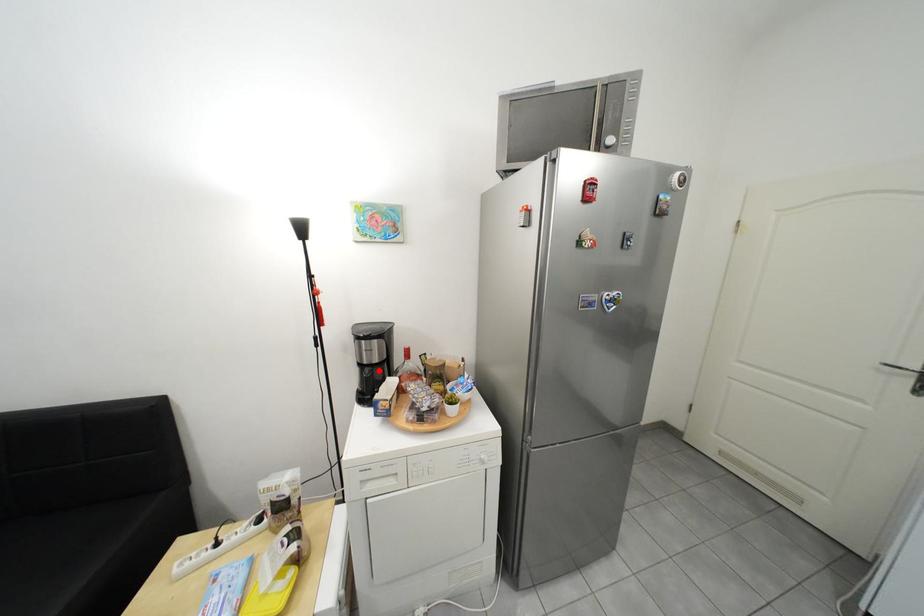
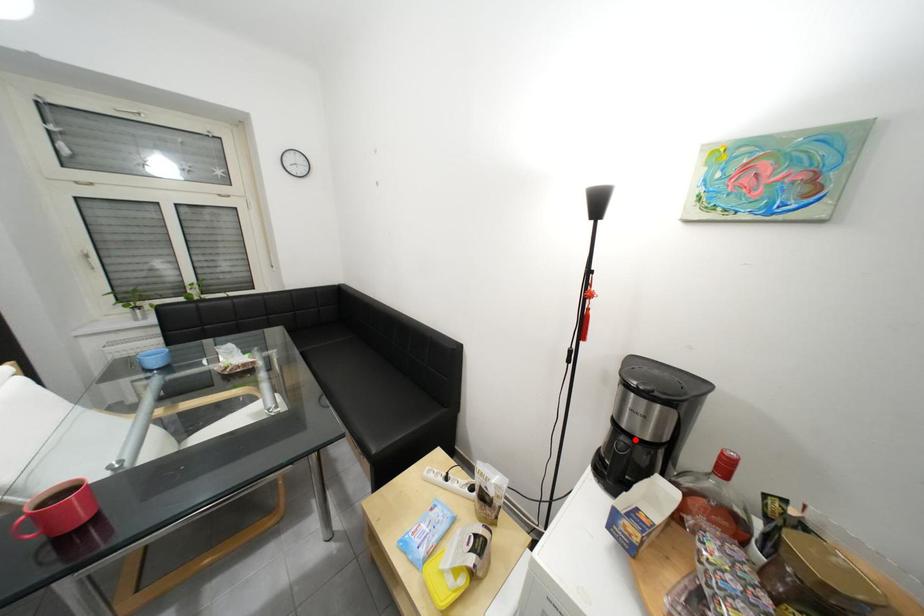
I am providing you with two images of the same scene from different viewpoints. A red point is marked on the first image and another point is marked on the second image. Do the highlighted points in image1 and image2 indicate the same real-world spot?

Yes